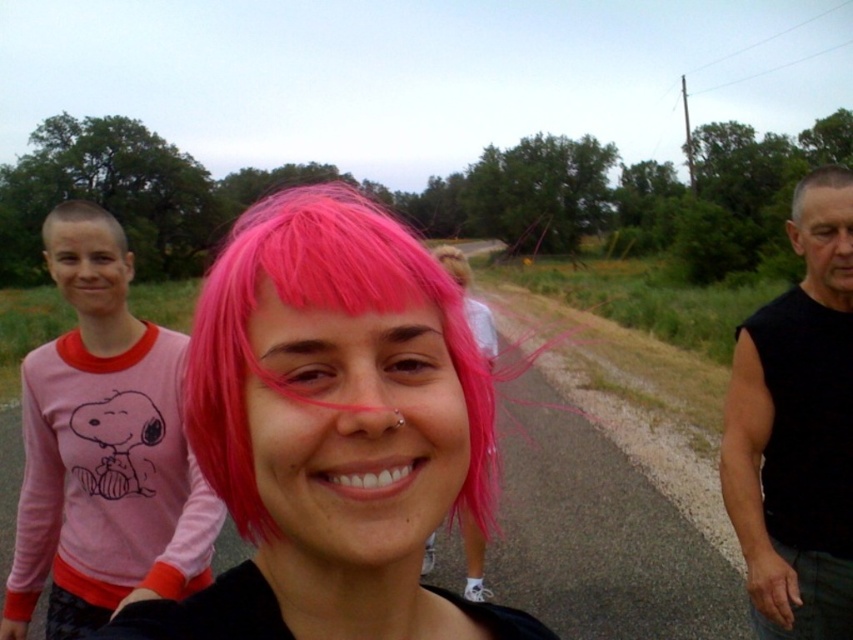
Can you confirm if pink matte wig at center is positioned below pink fabric shirt at left?

No.

Is pink matte wig at center to the right of pink fabric shirt at left from the viewer's perspective?

Indeed, pink matte wig at center is positioned on the right side of pink fabric shirt at left.

Does point (343, 420) come closer to viewer compared to point (90, 612)?

That is True.

Find the location of a particular element. pink matte wig at center is located at coordinates (334, 432).

Does pink fabric shirt at left come in front of black sleeveless shirt at right?

Yes, it is in front of black sleeveless shirt at right.

In the scene shown: Is pink fabric shirt at left bigger than black sleeveless shirt at right?

Yes.

Locate an element on the screen. pink fabric shirt at left is located at coordinates (103, 449).

Which is in front, point (88, 483) or point (49, 225)?

Point (49, 225) is more forward.

Does point (57, 448) come behind point (126, 250)?

No.

Does point (57, 218) come closer to viewer compared to point (94, 216)?

Yes.

Find the location of a particular element. The height and width of the screenshot is (640, 853). pink fabric shirt at left is located at coordinates (103, 449).